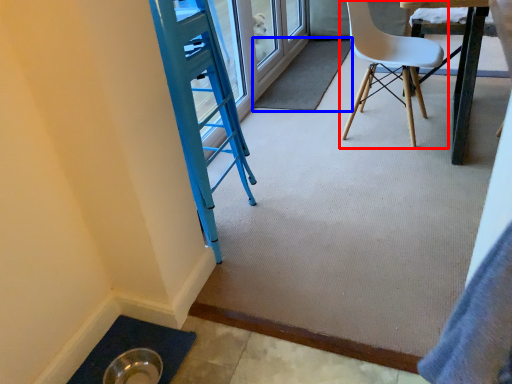
Question: Which of the following is the closest to the observer, chair (highlighted by a red box) or mat (highlighted by a blue box)?

Choices:
 (A) chair
 (B) mat

Answer: (A)